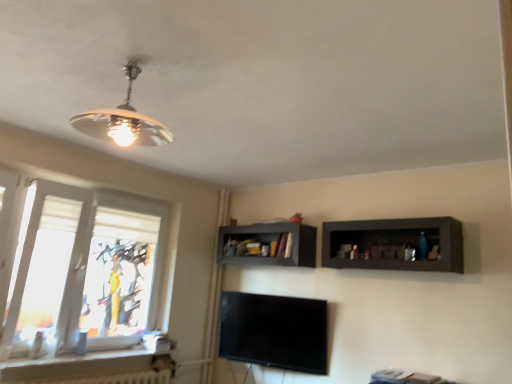
Question: Does white glossy window sill at lower left have a lesser height compared to white textured window at left?

Choices:
 (A) yes
 (B) no

Answer: (A)

Question: Is white glossy window sill at lower left completely or partially outside of white textured window at left?

Choices:
 (A) yes
 (B) no

Answer: (A)

Question: From a real-world perspective, is white glossy window sill at lower left located higher than white textured window at left?

Choices:
 (A) no
 (B) yes

Answer: (A)

Question: Is white glossy window sill at lower left thinner than white textured window at left?

Choices:
 (A) yes
 (B) no

Answer: (B)

Question: Does white glossy window sill at lower left appear on the right side of white textured window at left?

Choices:
 (A) yes
 (B) no

Answer: (B)

Question: Does point (50, 374) appear closer or farther from the camera than point (285, 264)?

Choices:
 (A) farther
 (B) closer

Answer: (B)

Question: Is white glossy window sill at lower left taller or shorter than matte gray shelf at center, which is the 2th shelf in front-to-back order?

Choices:
 (A) tall
 (B) short

Answer: (B)

Question: Considering the positions of white glossy window sill at lower left and matte gray shelf at center, marked as the first shelf in a left-to-right arrangement, in the image, is white glossy window sill at lower left bigger or smaller than matte gray shelf at center, marked as the first shelf in a left-to-right arrangement,?

Choices:
 (A) big
 (B) small

Answer: (B)

Question: From the image's perspective, is white glossy window sill at lower left above or below matte gray shelf at center, marked as the first shelf in a left-to-right arrangement?

Choices:
 (A) above
 (B) below

Answer: (B)

Question: Is dark wood shelf at right, positioned as the 1th shelf in front-to-back order, wider or thinner than white glossy window sill at lower left?

Choices:
 (A) thin
 (B) wide

Answer: (B)

Question: Choose the correct answer: Is dark wood shelf at right, positioned as the 1th shelf in front-to-back order, inside white glossy window sill at lower left or outside it?

Choices:
 (A) outside
 (B) inside

Answer: (A)

Question: In the image, is dark wood shelf at right, acting as the first shelf starting from the right, positioned in front of or behind white glossy window sill at lower left?

Choices:
 (A) behind
 (B) front

Answer: (A)

Question: Is dark wood shelf at right, acting as the first shelf starting from the right, taller or shorter than white glossy window sill at lower left?

Choices:
 (A) short
 (B) tall

Answer: (B)

Question: Is point (450, 231) closer or farther from the camera than point (134, 375)?

Choices:
 (A) closer
 (B) farther

Answer: (A)

Question: Based on their sizes in the image, would you say dark wood shelf at right, acting as the first shelf starting from the right, is bigger or smaller than white textured radiator at lower left?

Choices:
 (A) big
 (B) small

Answer: (A)